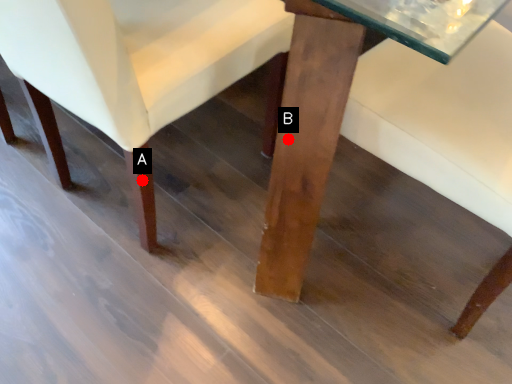
Question: Two points are circled on the image, labeled by A and B beside each circle. Which point is farther from the camera taking this photo?

Choices:
 (A) A is further
 (B) B is further

Answer: (A)